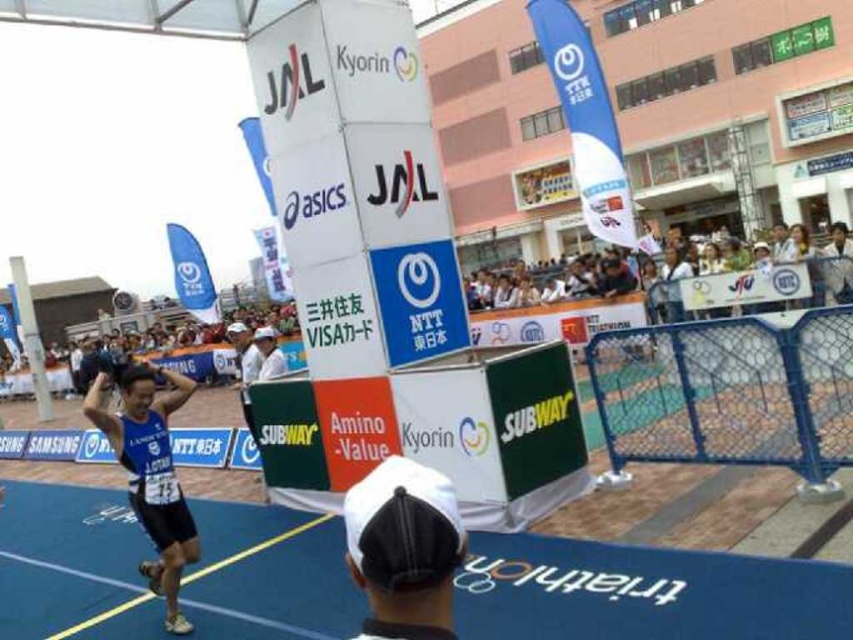
You are a photographer positioned at the finish line of the triathlon. You need to capture a photo that includes both the blue fabric jersey at left and the white fabric shirt at center. The camera you are using has a maximum focus range of 2.5 meters. Will you be able to fit both subjects into the frame without moving closer?

The blue fabric jersey at left is 2.66 meters from the white fabric shirt at center. Since the distance between them exceeds the camera maximum focus range of 2.5 meters, you will not be able to fit both subjects into the frame without moving closer.

You are a photographer positioned at the finish line of a triathlon. You want to capture a closeup shot of the white matte cap at lower center. Given that your camera requires a minimum distance of 1.5 meters to focus properly, will you be able to take a clear photo?

The distance between the white matte cap at lower center and the camera is 1.40 meters, which is less than the required 1.5 meters for proper focus. Therefore, the photographer cannot take a clear photo.